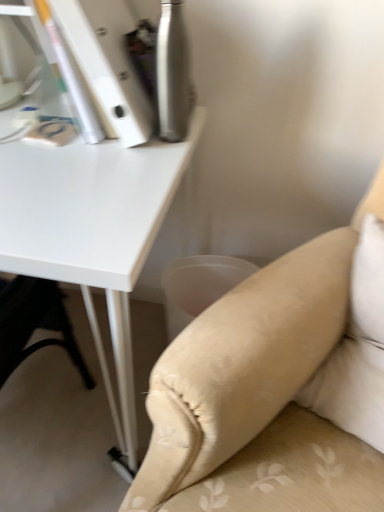
What is the approximate height of beige fabric couch at lower right?

beige fabric couch at lower right is 37.44 inches in height.

What is the approximate width of beige fabric couch at lower right?

beige fabric couch at lower right is 37.00 inches in width.

Image resolution: width=384 pixels, height=512 pixels. I want to click on beige fabric couch at lower right, so click(245, 362).

Which object is more forward, white matte table at upper left or beige fabric couch at lower right?

beige fabric couch at lower right.

How many degrees apart are the facing directions of white matte table at upper left and beige fabric couch at lower right?

The angle between the facing direction of white matte table at upper left and the facing direction of beige fabric couch at lower right is 29.7 degrees.

The width and height of the screenshot is (384, 512). Find the location of `studio couch in front of the white matte table at upper left`. studio couch in front of the white matte table at upper left is located at coordinates (245, 362).

Is white matte table at upper left taller or shorter than beige fabric couch at lower right?

Considering their sizes, white matte table at upper left has less height than beige fabric couch at lower right.

From the image's perspective, between white matte table at upper left and beige fabric pillow at lower right, which one is located above?

white matte table at upper left, from the image's perspective.

Identify the location of table on the left side of beige fabric pillow at lower right. The image size is (384, 512). (92, 231).

Considering the relative positions of white matte table at upper left and beige fabric pillow at lower right in the image provided, is white matte table at upper left to the left or to the right of beige fabric pillow at lower right?

Clearly, white matte table at upper left is on the left of beige fabric pillow at lower right in the image.

Would you consider white matte table at upper left to be distant from beige fabric pillow at lower right?

No.

Is beige fabric couch at lower right outside of beige fabric pillow at lower right?

beige fabric couch at lower right is positioned outside beige fabric pillow at lower right.

Which is behind, beige fabric couch at lower right or beige fabric pillow at lower right?

Positioned behind is beige fabric pillow at lower right.

Could you tell me if beige fabric couch at lower right is facing beige fabric pillow at lower right?

No, beige fabric couch at lower right is not turned towards beige fabric pillow at lower right.

Does beige fabric couch at lower right appear on the left side of beige fabric pillow at lower right?

Yes.

Which object is thinner, beige fabric couch at lower right or white matte table at upper left?

white matte table at upper left.

The width and height of the screenshot is (384, 512). What are the coordinates of `table lying behind the beige fabric couch at lower right` in the screenshot? It's located at (92, 231).

Which of these two, beige fabric couch at lower right or white matte table at upper left, is bigger?

Bigger between the two is white matte table at upper left.

Is point (373, 272) positioned in front of point (168, 429)?

No, (373, 272) is further to viewer.

Considering the sizes of objects beige fabric pillow at lower right and beige fabric couch at lower right in the image provided, who is taller, beige fabric pillow at lower right or beige fabric couch at lower right?

beige fabric couch at lower right is taller.

Considering the relative positions of beige fabric pillow at lower right and beige fabric couch at lower right in the image provided, is beige fabric pillow at lower right in front of beige fabric couch at lower right?

No, beige fabric pillow at lower right is behind beige fabric couch at lower right.

Considering the sizes of beige fabric pillow at lower right and beige fabric couch at lower right in the image, is beige fabric pillow at lower right wider or thinner than beige fabric couch at lower right?

Clearly, beige fabric pillow at lower right has less width compared to beige fabric couch at lower right.

Is beige fabric pillow at lower right positioned with its back to white matte table at upper left?

That's not correct — beige fabric pillow at lower right is not looking away from white matte table at upper left.

From a real-world perspective, is beige fabric pillow at lower right beneath white matte table at upper left?

Incorrect, from a real-world perspective, beige fabric pillow at lower right is higher than white matte table at upper left.

Based on the photo, from the image's perspective, which one is positioned lower, beige fabric pillow at lower right or white matte table at upper left?

beige fabric pillow at lower right, from the image's perspective.

Can white matte table at upper left be found inside beige fabric pillow at lower right?

No, beige fabric pillow at lower right does not contain white matte table at upper left.

The image size is (384, 512). I want to click on studio couch positioned vertically above the white matte table at upper left (from a real-world perspective), so click(245, 362).

Where is `pillow on the right of white matte table at upper left`? This screenshot has width=384, height=512. pillow on the right of white matte table at upper left is located at coordinates (357, 350).

Estimate the real-world distances between objects in this image. Which object is closer to white matte table at upper left, beige fabric pillow at lower right or beige fabric couch at lower right?

The object closer to white matte table at upper left is beige fabric couch at lower right.

From the image, which object appears to be farther from beige fabric couch at lower right, beige fabric pillow at lower right or white matte table at upper left?

white matte table at upper left is further to beige fabric couch at lower right.

Estimate the real-world distances between objects in this image. Which object is closer to beige fabric pillow at lower right, beige fabric couch at lower right or white matte table at upper left?

beige fabric couch at lower right lies closer to beige fabric pillow at lower right than the other object.

From the picture: Estimate the real-world distances between objects in this image. Which object is closer to beige fabric couch at lower right, white matte table at upper left or beige fabric pillow at lower right?

Based on the image, beige fabric pillow at lower right appears to be nearer to beige fabric couch at lower right.

From the image, which object appears to be farther from white matte table at upper left, beige fabric couch at lower right or beige fabric pillow at lower right?

The object further to white matte table at upper left is beige fabric pillow at lower right.

Based on their spatial positions, is white matte table at upper left or beige fabric couch at lower right closer to beige fabric pillow at lower right?

beige fabric couch at lower right lies closer to beige fabric pillow at lower right than the other object.

This screenshot has width=384, height=512. In order to click on studio couch between white matte table at upper left and beige fabric pillow at lower right in the horizontal direction in this screenshot , I will do `click(245, 362)`.